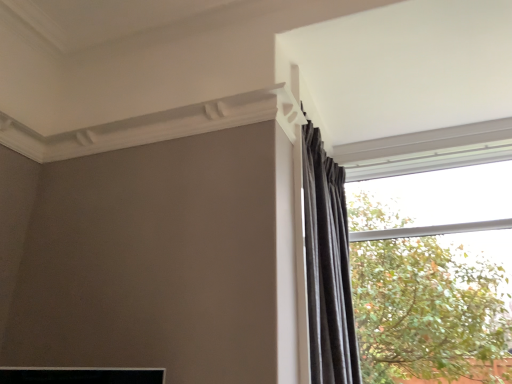
Question: From the image's perspective, is black velvet curtain at upper right above or below transparent glass window at upper right?

Choices:
 (A) above
 (B) below

Answer: (A)

Question: Considering the positions of black velvet curtain at upper right and transparent glass window at upper right in the image, is black velvet curtain at upper right wider or thinner than transparent glass window at upper right?

Choices:
 (A) wide
 (B) thin

Answer: (A)

Question: Considering the relative positions of black velvet curtain at upper right and transparent glass window at upper right in the image provided, is black velvet curtain at upper right to the left or to the right of transparent glass window at upper right?

Choices:
 (A) right
 (B) left

Answer: (B)

Question: Is point (349, 150) closer or farther from the camera than point (350, 302)?

Choices:
 (A) farther
 (B) closer

Answer: (A)

Question: From the image's perspective, is transparent glass window at upper right positioned above or below black velvet curtain at upper right?

Choices:
 (A) below
 (B) above

Answer: (A)

Question: In terms of height, does transparent glass window at upper right look taller or shorter compared to black velvet curtain at upper right?

Choices:
 (A) tall
 (B) short

Answer: (B)

Question: Would you say transparent glass window at upper right is to the left or to the right of black velvet curtain at upper right in the picture?

Choices:
 (A) left
 (B) right

Answer: (B)